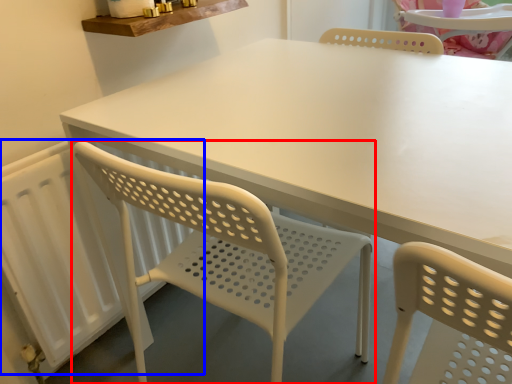
Question: Which point is closer to the camera, chair (highlighted by a red box) or radiator (highlighted by a blue box)?

Choices:
 (A) chair
 (B) radiator

Answer: (A)